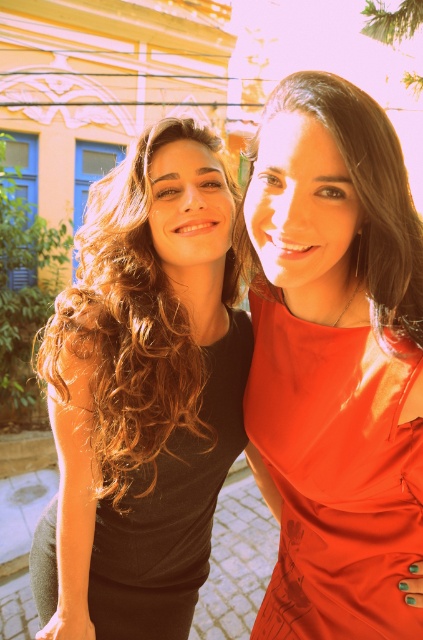
Question: Can you confirm if satin orange dress at right is positioned to the right of matte red dress at center?

Choices:
 (A) no
 (B) yes

Answer: (A)

Question: Can you confirm if satin orange dress at right is positioned below matte red dress at center?

Choices:
 (A) no
 (B) yes

Answer: (B)

Question: Based on their relative distances, which object is farther from the satin orange dress at right?

Choices:
 (A) matte red dress at center
 (B) black matte dress at left

Answer: (A)

Question: Estimate the real-world distances between objects in this image. Which object is farther from the matte black dress at left?

Choices:
 (A) satin orange dress at right
 (B) black matte dress at left
 (C) matte red dress at center

Answer: (C)

Question: Which point is closer to the camera?

Choices:
 (A) matte black dress at left
 (B) satin orange dress at right

Answer: (B)

Question: In this image, where is satin orange dress at right located relative to black matte dress at left?

Choices:
 (A) above
 (B) below

Answer: (A)